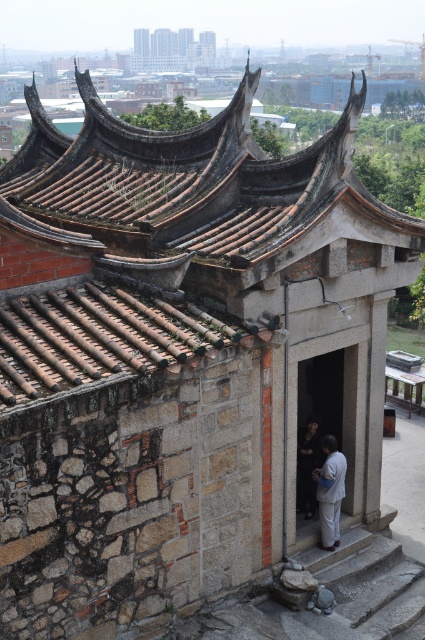
Is brown stone temple at upper center bigger than dark gray fabric at center?

Correct, brown stone temple at upper center is larger in size than dark gray fabric at center.

Is brown stone temple at upper center to the right of dark gray fabric at center from the viewer's perspective?

Incorrect, brown stone temple at upper center is not on the right side of dark gray fabric at center.

Image resolution: width=425 pixels, height=640 pixels. I want to click on brown stone temple at upper center, so click(172, 51).

Is the position of dark gray fabric pants at center more distant than that of dark gray fabric at center?

No, dark gray fabric pants at center is closer to the viewer.

Which of these two, dark gray fabric pants at center or dark gray fabric at center, stands taller?

dark gray fabric pants at center is taller.

This screenshot has width=425, height=640. Describe the element at coordinates (329, 492) in the screenshot. I see `dark gray fabric pants at center` at that location.

The width and height of the screenshot is (425, 640). What are the coordinates of `dark gray fabric pants at center` in the screenshot? It's located at (329, 492).

Is brown tiled roof at upper center further to camera compared to dark gray fabric pants at center?

That is False.

Identify the location of brown tiled roof at upper center. This screenshot has height=640, width=425. (189, 182).

At what (x,y) coordinates should I click in order to perform the action: click on brown tiled roof at upper center. Please return your answer as a coordinate pair (x, y). The height and width of the screenshot is (640, 425). Looking at the image, I should click on (189, 182).